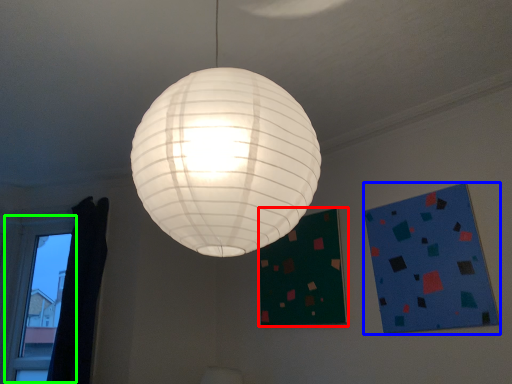
Question: Which object is the closest to the bulletin board (highlighted by a red box)? Choose among these: design (highlighted by a blue box) or window (highlighted by a green box).

Choices:
 (A) design
 (B) window

Answer: (A)